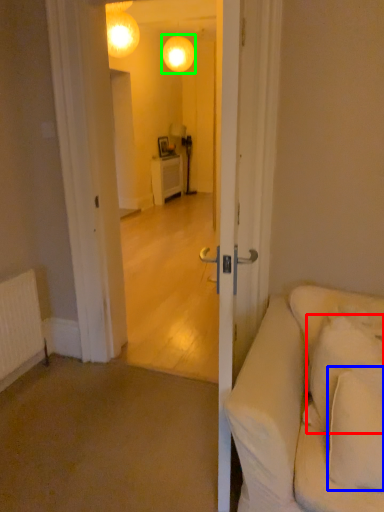
Question: Which is farther away from pillow (highlighted by a red box)? pillow (highlighted by a blue box) or lamp (highlighted by a green box)?

Choices:
 (A) pillow
 (B) lamp

Answer: (B)